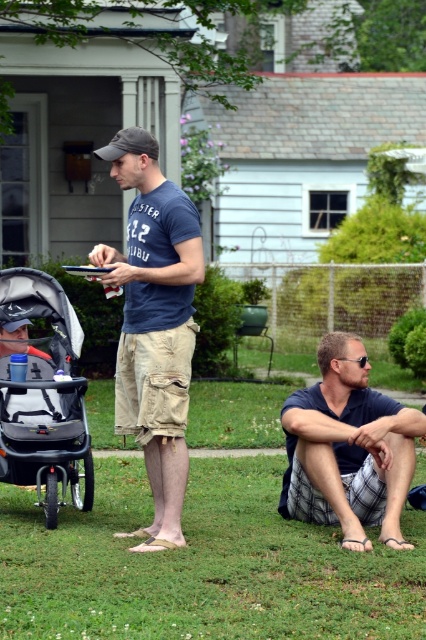
You are standing at point (138, 154) and want to walk to point (83, 440). Which direction should you move in?

You should move backward to reach point (83, 440) since it is behind point (138, 154).

You are planning to place a new bench in the backyard that is 1.2 meters wide. The dark blue shirt at lower right and the gray fabric stroller at left are currently in the area. Based on their widths, can the bench fit between them without overlapping?

The dark blue shirt at lower right is wider than the gray fabric stroller at left. Since the bench is 1.2 meters wide, but the exact widths of the objects aren

You are a photographer trying to capture a photo of the dark blue shirt at lower right and the gray fabric stroller at left. Which object should you focus on first if you want to include both in your shot without moving the camera?

The dark blue shirt at lower right should be focused on first because it is positioned below the gray fabric stroller at left, so adjusting the camera angle to include both would require ensuring the lower object is in frame first.